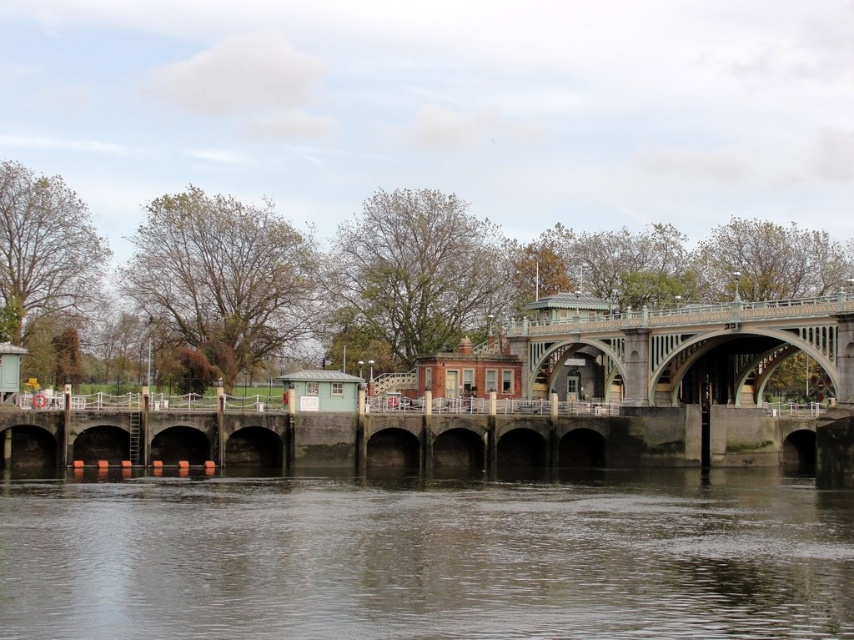
From the picture: You are standing at the point marked as point (x=425, y=557) in the image. What is the nearest object to you in the scene?

The nearest object to you at point (x=425, y=557) is the brown murky water at lower center, as it is located exactly at that coordinate.

You are standing at the riverside and want to cross to the other side. The green stone bridge at center is your only option. However, you notice the brown murky water at lower center. Is the bridge accessible from where you are standing?

The brown murky water at lower center is closer to the viewer than the green stone bridge at center, so the bridge is behind the water and may not be directly accessible from your current position. You might need to move around the water to reach the bridge.

You are standing at the riverside and want to determine the relative positions of two points marked on the bridge. Which point, point (402, 541) or point (724, 362), is closer to you?

Point (402, 541) is closer to the viewer than point (724, 362).